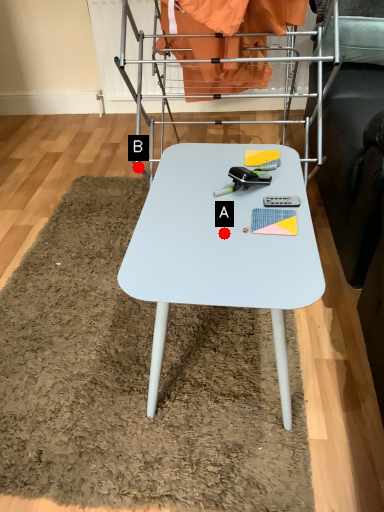
Question: Two points are circled on the image, labeled by A and B beside each circle. Which point is farther to the camera?

Choices:
 (A) A is further
 (B) B is further

Answer: (B)